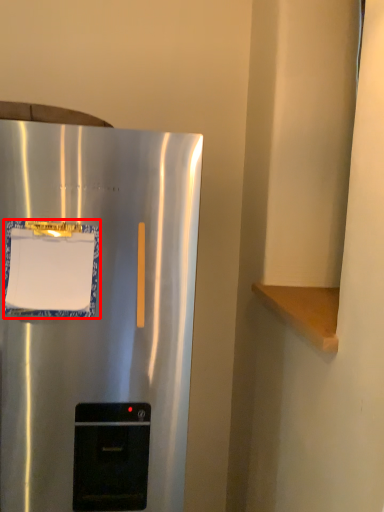
Question: From the image's perspective, what is the correct spatial relationship of paper (annotated by the red box) in relation to refrigerator?

Choices:
 (A) above
 (B) below

Answer: (A)